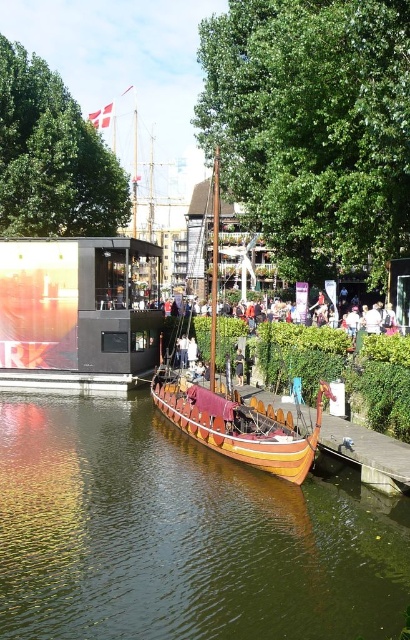
You are an architect designing a new bridge that needs to pass over the brown wooden boat at center and the wooden polished boat at center. Based on their heights, which boat requires a taller clearance for the bridge?

The wooden polished boat at center requires a taller clearance because it is taller than the brown wooden boat at center according to the description.

You are organizing a boat parade and need to arrange the brown wooden boat at center and the wooden polished boat at center along a narrow canal. Given their sizes, which boat should you place first to ensure both can fit without overlapping?

The brown wooden boat at center occupies less space than the wooden polished boat at center, so you should place the wooden polished boat at center first, as it is larger and ensuring there is enough space for both boats.

You are organizing a boat race and need to ensure all boats fit within a 3.5 meter width limit. Given the brown wooden boat at center and the wooden polished boat at center, which boat would you select to ensure compliance with the width requirement?

The wooden polished boat at center is narrower than the brown wooden boat at center, so selecting the wooden polished boat at center ensures compliance with the 3.5 meter width limit.